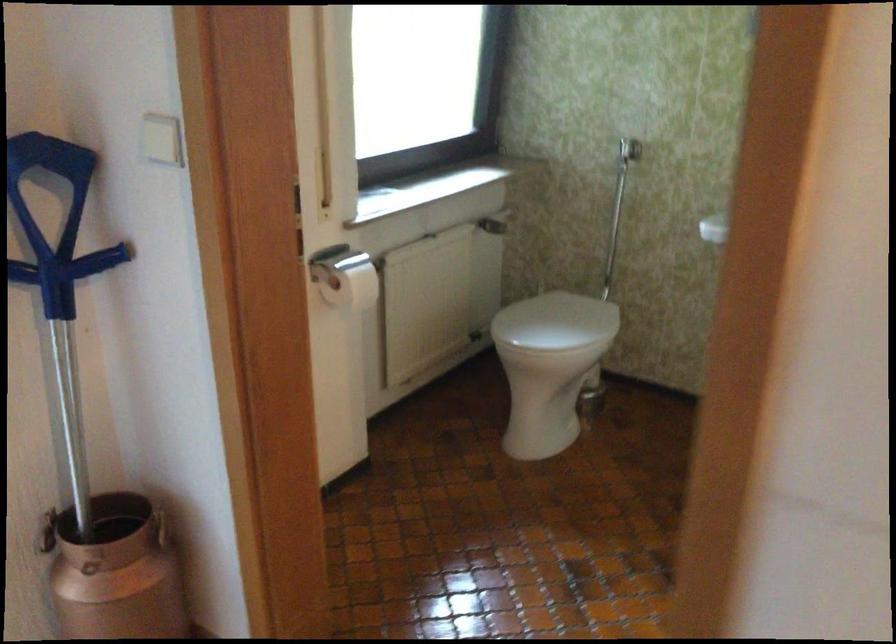
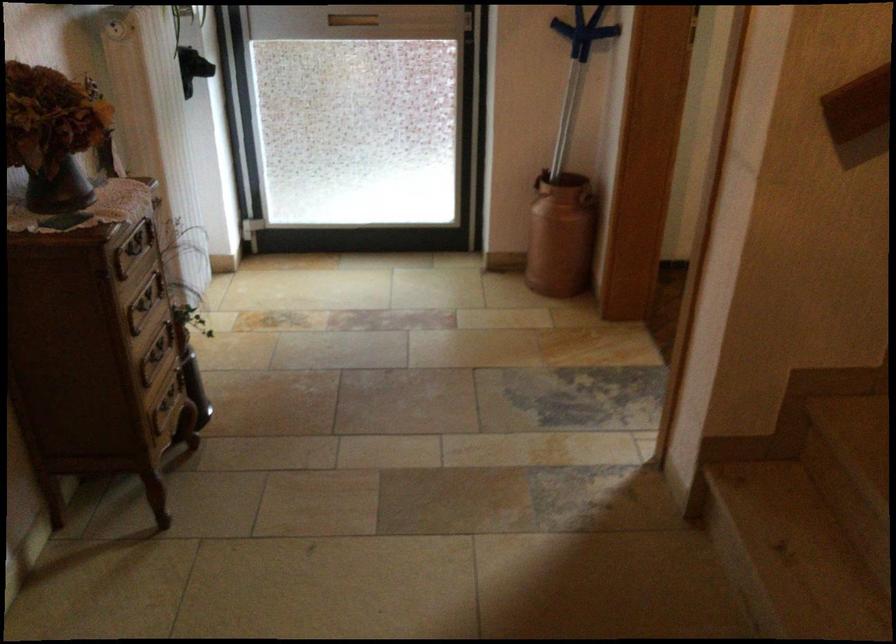
Locate, in the second image, the point that corresponds to [75,268] in the first image.

(583, 31)